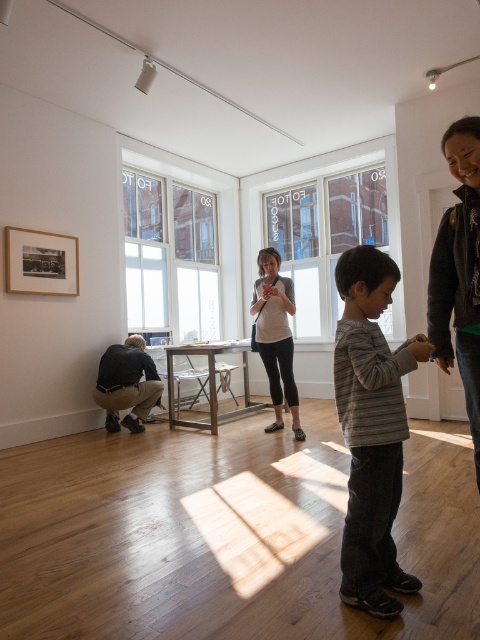
Question: Which point is closer to the camera taking this photo?

Choices:
 (A) (50, 257)
 (B) (155, 368)
 (C) (474, 352)

Answer: (C)

Question: Is matte gray sweater at center behind wooden picture frame at upper left?

Choices:
 (A) no
 (B) yes

Answer: (A)

Question: Which of the following is the closest to the observer?

Choices:
 (A) matte gray sweater at center
 (B) striped cotton shirt at center
 (C) wooden picture frame at upper left
 (D) dark gray fabric pants at lower left

Answer: (B)

Question: Is the position of dark gray sweater at right less distant than that of matte gray sweater at center?

Choices:
 (A) no
 (B) yes

Answer: (B)

Question: Estimate the real-world distances between objects in this image. Which object is closer to the dark gray fabric pants at lower left?

Choices:
 (A) matte gray sweater at center
 (B) wooden picture frame at upper left

Answer: (B)

Question: Observing the image, what is the correct spatial positioning of dark gray sweater at right in reference to wooden picture frame at upper left?

Choices:
 (A) below
 (B) above

Answer: (A)